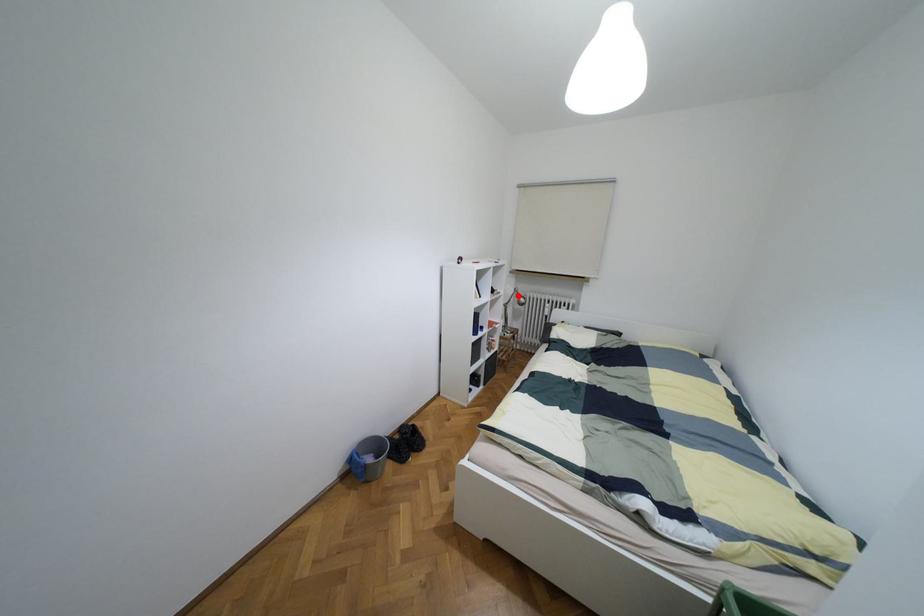
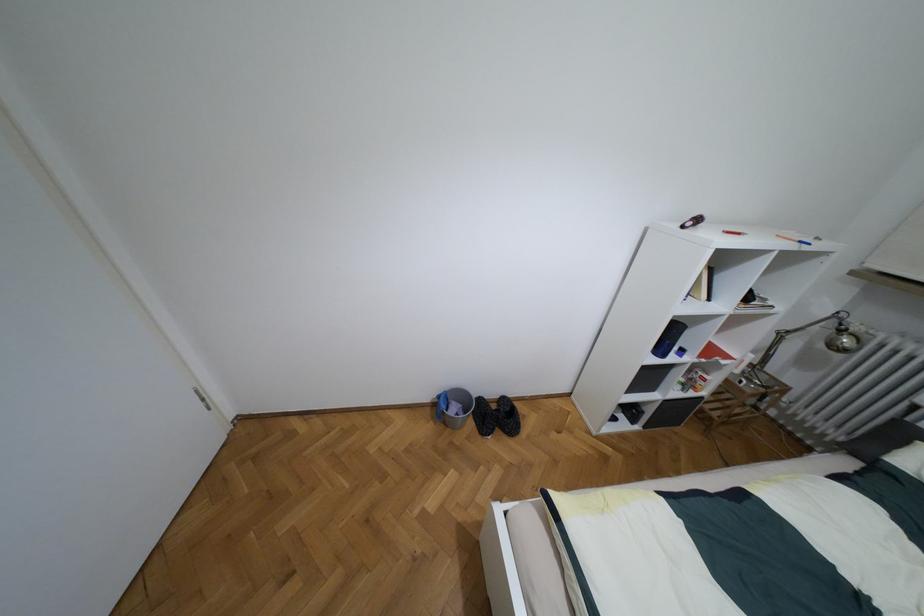
Question: I am providing you with two images of the same scene from different viewpoints. Given a red point in image1, look at the same physical point in image2. Is it:

Choices:
 (A) Closer to the viewpoint
 (B) Farther from the viewpoint

Answer: (B)